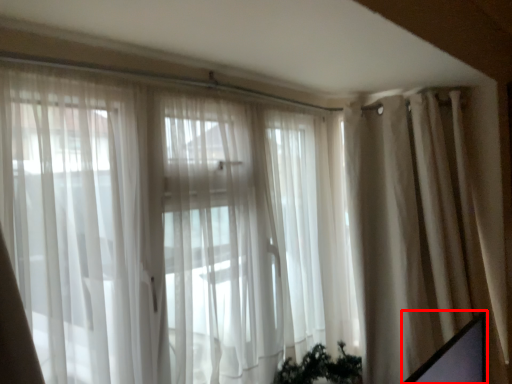
Question: From the image's perspective, considering the relative positions of computer screen (annotated by the red box) and curtain in the image provided, where is computer screen (annotated by the red box) located with respect to the staircase?

Choices:
 (A) above
 (B) below

Answer: (B)